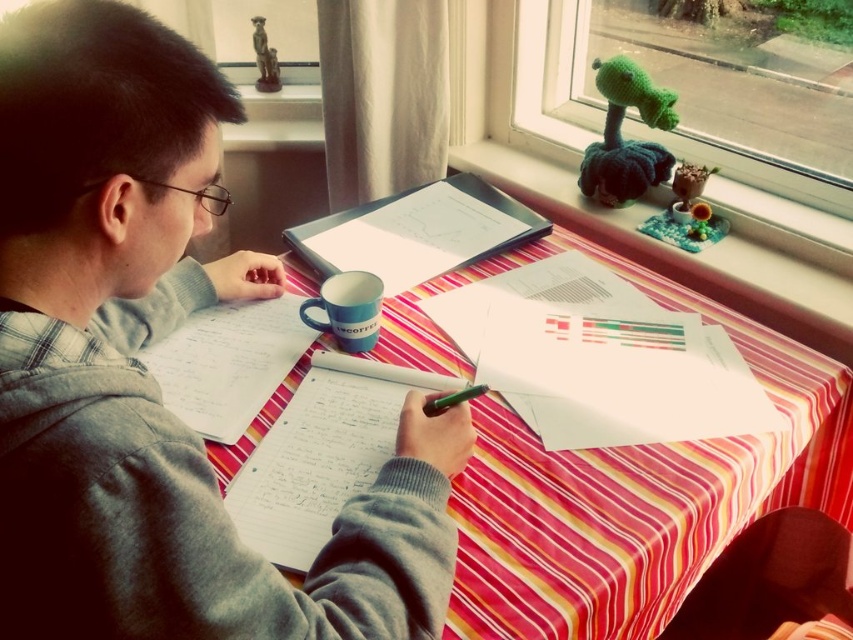
You are a photographer trying to capture a closeup shot of the scene. You have two points marked on your viewfinder at coordinates point (341, 337) and point (468, 388). Which point is closer to your camera lens?

Point (341, 337) is further to the viewer than point (468, 388), so the point closer to the camera lens is point (468, 388).

You are a photographer taking a picture of the scene. You want to ensure that both the gray fleece hoodie at upper left and the white paper notebook at center are clearly visible in the photo. However, the gray fleece hoodie is currently blocking part of the notebook. What adjustment can you make to the camera angle or composition to capture both objects without obstruction?

Since the gray fleece hoodie at upper left is positioned over the white paper notebook at center, you can adjust the camera angle by moving it slightly upward or to the side to avoid the hoodie blocking the notebook. Alternatively, you can recompose the shot to include both objects without overlapping by shifting the hoodie or notebook slightly, but since you can only adjust the camera, tilting or angling the camera downward might also help capture the notebook beneath the hoodie more clearly.

You are organizing items on a table for a presentation. You need to place a white paper notebook at center and a green matte pen at center in a specific arrangement. According to the image, where should you position the white paper notebook relative to the green matte pen?

The white paper notebook at center should be positioned to the left of the green matte pen at center as per the image.